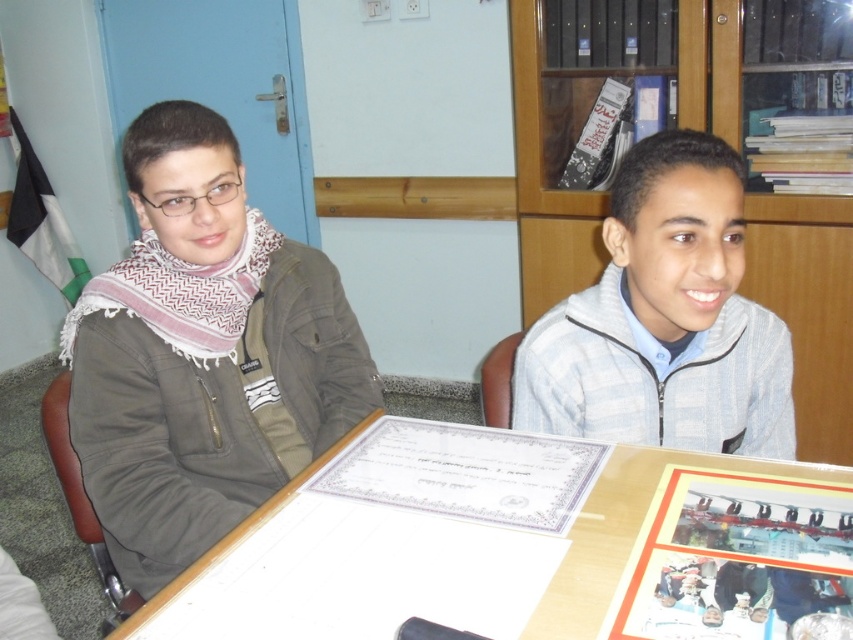
Question: Can you confirm if white paper at center is positioned to the left of light gray zip-up sweater at right?

Choices:
 (A) yes
 (B) no

Answer: (A)

Question: Which object is closer to the camera taking this photo?

Choices:
 (A) white paper at center
 (B) light gray zip-up sweater at right

Answer: (A)

Question: Which object is closer to the camera taking this photo?

Choices:
 (A) light gray zip-up sweater at right
 (B) white paper at center
 (C) matte green jacket at left

Answer: (B)

Question: Considering the real-world distances, which object is closest to the matte green jacket at left?

Choices:
 (A) light gray zip-up sweater at right
 (B) white paper at center

Answer: (B)

Question: Can you confirm if white paper at center is smaller than light gray zip-up sweater at right?

Choices:
 (A) no
 (B) yes

Answer: (A)

Question: Is white paper at center further to camera compared to matte green jacket at left?

Choices:
 (A) yes
 (B) no

Answer: (B)